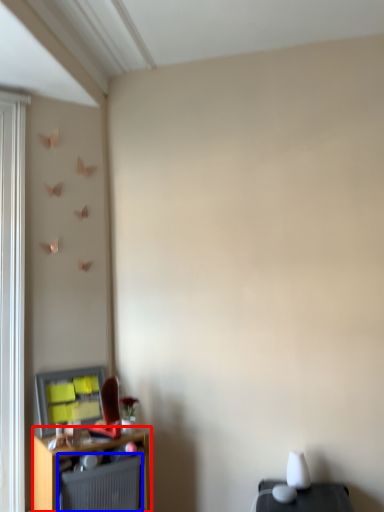
Question: Among these objects, which one is nearest to the camera, shelf (highlighted by a red box) or radiator (highlighted by a blue box)?

Choices:
 (A) shelf
 (B) radiator

Answer: (A)